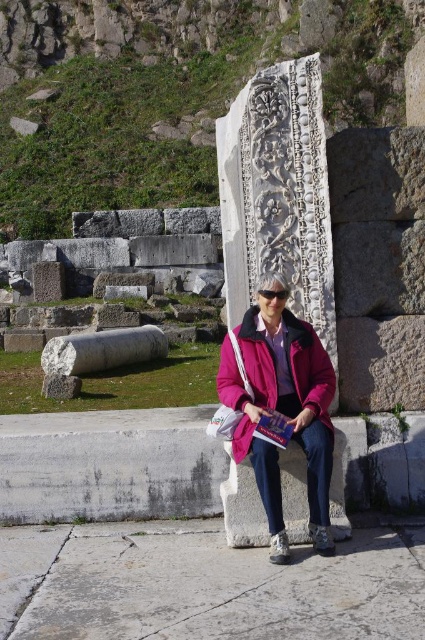
Please provide the coordinates of the carved stone column at center in the image.

The carved stone column at center is located at coordinates point (277, 195).

You are a tour guide at the archaeological site. A visitor asks if the carved stone column at center is bigger than their pink fabric jacket at center. How do you respond?

The carved stone column at center is indeed larger in size than the pink fabric jacket at center, so yes, it is bigger.